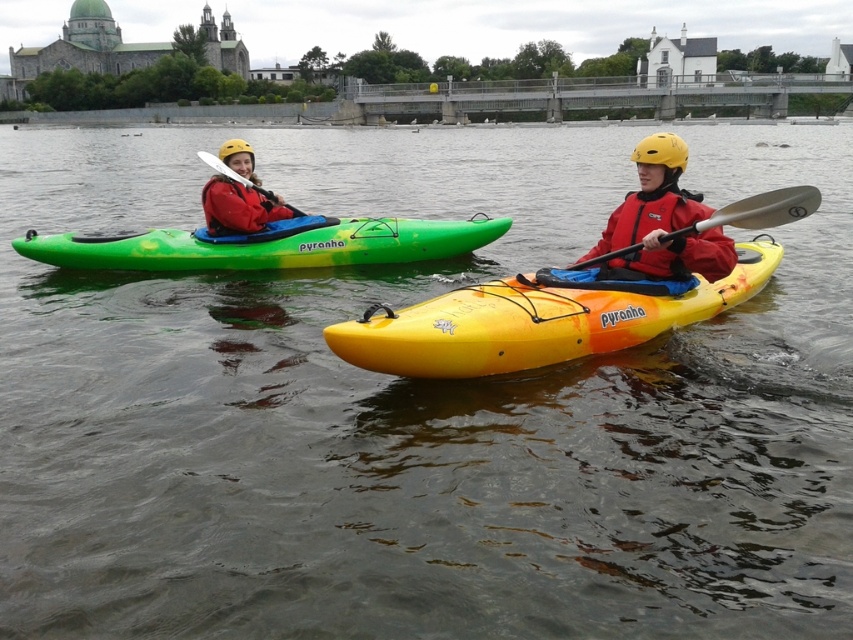
You are a photographer trying to capture both the yellow matte kayak at center and the green matte kayak at left in a single shot. Based on their positions, which kayak will appear closer to the bottom of the photo?

The yellow matte kayak at center is located below the green matte kayak at left, so it will appear closer to the bottom of the photo.

In the scene shown: You are a photographer trying to capture a clear shot of the yellow matte kayak at center and the matte red jacket at left. Since you want the red jacket to be the focus, which object should you position closer to the camera to ensure it appears larger in the photo?

The yellow matte kayak at center is much taller than the matte red jacket at left. To make the matte red jacket at left appear larger in the photo, you should position it closer to the camera than the yellow matte kayak at center.